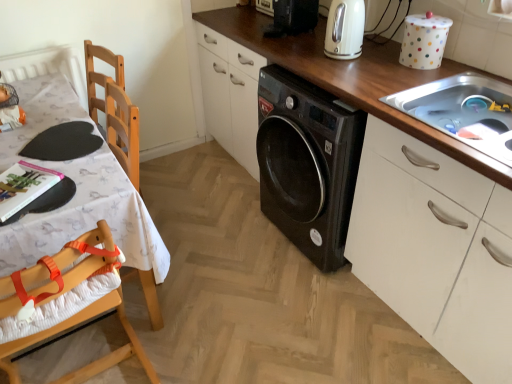
The image size is (512, 384). In order to click on blank space to the left of black plastic washing machine at upper center, which is counted as the first appliance, starting from the left in this screenshot , I will do `click(251, 24)`.